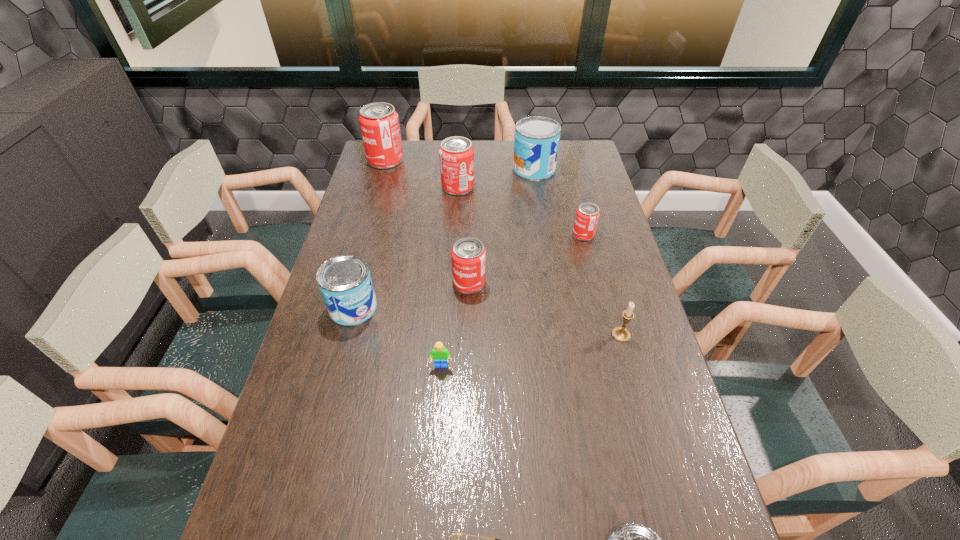
Locate an element on the screen. The width and height of the screenshot is (960, 540). the tallest can is located at coordinates (379, 123).

Locate an element on the screen. Image resolution: width=960 pixels, height=540 pixels. the leftmost red can is located at coordinates (379, 123).

Locate an element on the screen. the biggest blue can is located at coordinates (536, 143).

Image resolution: width=960 pixels, height=540 pixels. In order to click on the second farthest red can in this screenshot , I will do `click(456, 154)`.

The image size is (960, 540). Identify the location of the second farthest blue can. (345, 283).

Locate an element on the screen. The width and height of the screenshot is (960, 540). the second smallest blue can is located at coordinates (345, 283).

The image size is (960, 540). Find the location of `the nearest red can`. the nearest red can is located at coordinates (468, 255).

Find the location of a particular element. The width and height of the screenshot is (960, 540). candle holder is located at coordinates (621, 334).

Locate an element on the screen. the third farthest red can is located at coordinates (587, 214).

This screenshot has width=960, height=540. What are the coordinates of `the smallest red can` in the screenshot? It's located at pyautogui.click(x=587, y=214).